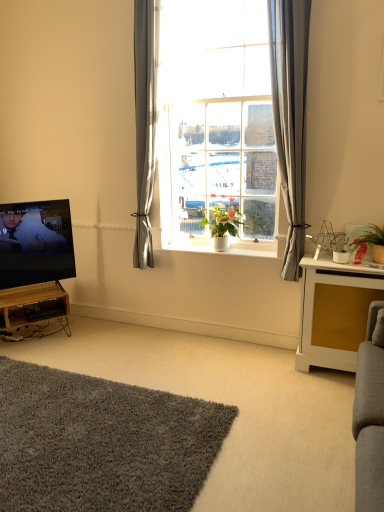
This screenshot has height=512, width=384. What do you see at coordinates (222, 118) in the screenshot?
I see `clear glass window at center` at bounding box center [222, 118].

The height and width of the screenshot is (512, 384). Find the location of `clear glass window at center`. clear glass window at center is located at coordinates (222, 118).

You are a GUI agent. You are given a task and a screenshot of the screen. Output one action in this format:
    pyautogui.click(x=<x>, y=<y>)
    Task: Click on the green matte plant at right, which ranks as the first houseplant in right-to-left order
    Image resolution: width=384 pixels, height=512 pixels.
    Given the screenshot: What is the action you would take?
    pyautogui.click(x=373, y=241)

This screenshot has height=512, width=384. What do you see at coordinates (231, 404) in the screenshot?
I see `soft gray carpet at lower left` at bounding box center [231, 404].

Identify the location of white textured cabinet at right, arranged as the second table when viewed from the left. (334, 312).

Does white textured cabinet at right, positioned as the 1th table in front-to-back order, have a greater width compared to green matte plant at center, arranged as the 1th houseplant when viewed from the back?

Correct, the width of white textured cabinet at right, positioned as the 1th table in front-to-back order, exceeds that of green matte plant at center, arranged as the 1th houseplant when viewed from the back.

From the image's perspective, starting from the white textured cabinet at right, which is the 2th table in back-to-front order, which houseplant is the 2nd one above? Please provide its 2D coordinates.

[(223, 226)]

From a real-world perspective, is white textured cabinet at right, positioned as the 1th table in front-to-back order, on top of green matte plant at center, which is the 1th houseplant in left-to-right order?

Actually, white textured cabinet at right, positioned as the 1th table in front-to-back order, is physically below green matte plant at center, which is the 1th houseplant in left-to-right order, in the real world.

From the image's perspective, which is above, clear glass window at center or green matte plant at right, which appears as the first houseplant when viewed from the front?

clear glass window at center, from the image's perspective.

The height and width of the screenshot is (512, 384). I want to click on window on the left of the green matte plant at right, which appears as the second houseplant when viewed from the left, so click(x=222, y=118).

From a real-world perspective, is clear glass window at center above or below green matte plant at right, which appears as the first houseplant when viewed from the front?

clear glass window at center is above green matte plant at right, which appears as the first houseplant when viewed from the front.

Can you confirm if clear glass window at center is positioned to the right of gray fabric curtain at center?

No.

Considering the sizes of objects clear glass window at center and gray fabric curtain at center in the image provided, who is taller, clear glass window at center or gray fabric curtain at center?

clear glass window at center is taller.

In terms of size, does clear glass window at center appear bigger or smaller than gray fabric curtain at center?

Considering their sizes, clear glass window at center takes up more space than gray fabric curtain at center.

Is clear glass window at center in contact with green matte plant at center, which is the 1th houseplant in left-to-right order?

No.

Based on the photo, how far apart are clear glass window at center and green matte plant at center, which is the 1th houseplant in left-to-right order?

clear glass window at center and green matte plant at center, which is the 1th houseplant in left-to-right order, are 24.53 inches apart.

Is clear glass window at center positioned with its back to green matte plant at center, which is the 1th houseplant in left-to-right order?

Yes.

Is clear glass window at center taller than green matte plant at center, which is the 1th houseplant in left-to-right order?

Yes, clear glass window at center is taller than green matte plant at center, which is the 1th houseplant in left-to-right order.

How much distance is there between matte black tv at left and gray fabric curtain at center?

matte black tv at left and gray fabric curtain at center are 2.08 meters apart from each other.

From a real-world perspective, is matte black tv at left under gray fabric curtain at center?

Correct, in the physical world, matte black tv at left is lower than gray fabric curtain at center.

Between matte black tv at left and gray fabric curtain at center, which one has larger width?

matte black tv at left is wider.

Does point (286, 120) appear closer or farther from the camera than point (319, 343)?

Clearly, point (286, 120) is closer to the camera than point (319, 343).

From a real-world perspective, which is physically below, clear glass window at center or white textured cabinet at right, which is counted as the first table, starting from the right?

white textured cabinet at right, which is counted as the first table, starting from the right.

Which of these two, clear glass window at center or white textured cabinet at right, which is the 2th table in back-to-front order, is smaller?

white textured cabinet at right, which is the 2th table in back-to-front order.

Is clear glass window at center turned away from white textured cabinet at right, positioned as the 1th table in front-to-back order?

No, clear glass window at center is not facing away from white textured cabinet at right, positioned as the 1th table in front-to-back order.

Could you tell me if green matte plant at right, which ranks as the first houseplant in right-to-left order, is facing wooden at left, positioned as the first table in back-to-front order?

No, green matte plant at right, which ranks as the first houseplant in right-to-left order, does not turn towards wooden at left, positioned as the first table in back-to-front order.

Can we say green matte plant at right, which is the 2th houseplant from back to front, lies outside wooden at left, which is counted as the 2th table, starting from the right?

Yes.

Which is behind, green matte plant at right, which is the 2th houseplant from back to front, or wooden at left, which is counted as the first table, starting from the left?

wooden at left, which is counted as the first table, starting from the left, is further away from the camera.

From the image's perspective, which table is the 1st one below the green matte plant at center, the 2th houseplant from the right? Please provide its 2D coordinates.

[(334, 312)]

There is a green matte plant at right, which appears as the first houseplant when viewed from the front. Identify the location of window above it (from a real-world perspective). (222, 118).

Based on their spatial positions, is gray fabric curtain at center or green matte plant at right, which ranks as the first houseplant in right-to-left order, closer to white painted wood at center?

gray fabric curtain at center lies closer to white painted wood at center than the other object.

From the picture: Looking at the image, which one is located further to green matte plant at right, which appears as the first houseplant when viewed from the front, gray fabric curtain at center or green matte plant at center, the 2th houseplant from the right?

green matte plant at center, the 2th houseplant from the right, is positioned further to the anchor green matte plant at right, which appears as the first houseplant when viewed from the front.

Considering their positions, is gray fabric curtain at center positioned further to white textured cabinet at right, positioned as the 1th table in front-to-back order, than clear glass window at center?

Among the two, clear glass window at center is located further to white textured cabinet at right, positioned as the 1th table in front-to-back order.

Estimate the real-world distances between objects in this image. Which object is closer to wooden at left, which is counted as the 2th table, starting from the right, white painted wood at center or white textured cabinet at right, which is counted as the first table, starting from the right?

The object closer to wooden at left, which is counted as the 2th table, starting from the right, is white painted wood at center.

Looking at the image, which one is located further to wooden at left, which is counted as the 2th table, starting from the right, white painted wood at center or green matte plant at center, the 2th houseplant viewed from the front?

green matte plant at center, the 2th houseplant viewed from the front, is positioned further to the anchor wooden at left, which is counted as the 2th table, starting from the right.

From the image, which object appears to be farther from gray fabric curtain at center, matte black tv at left or green matte plant at right, which is the 2th houseplant from back to front?

matte black tv at left is positioned further to the anchor gray fabric curtain at center.

Considering their positions, is clear glass window at center positioned further to white painted wood at center than matte black tv at left?

matte black tv at left is further to white painted wood at center.

From the picture: Based on their spatial positions, is white textured cabinet at right, which is counted as the first table, starting from the right, or soft gray carpet at lower left further from white painted wood at center?

soft gray carpet at lower left is further to white painted wood at center.

The width and height of the screenshot is (384, 512). In order to click on window sill between matte black tv at left and green matte plant at right, which appears as the second houseplant when viewed from the left, from left to right in this screenshot , I will do `click(222, 252)`.

Identify the location of window sill between clear glass window at center and soft gray carpet at lower left in the up-down direction. This screenshot has height=512, width=384. (222, 252).

In order to click on window sill between wooden at left, which is counted as the 2th table, starting from the right, and green matte plant at center, arranged as the 1th houseplant when viewed from the back in this screenshot , I will do `click(222, 252)`.

I want to click on curtain between matte black tv at left and green matte plant at right, which appears as the second houseplant when viewed from the left, in the horizontal direction, so click(x=290, y=116).